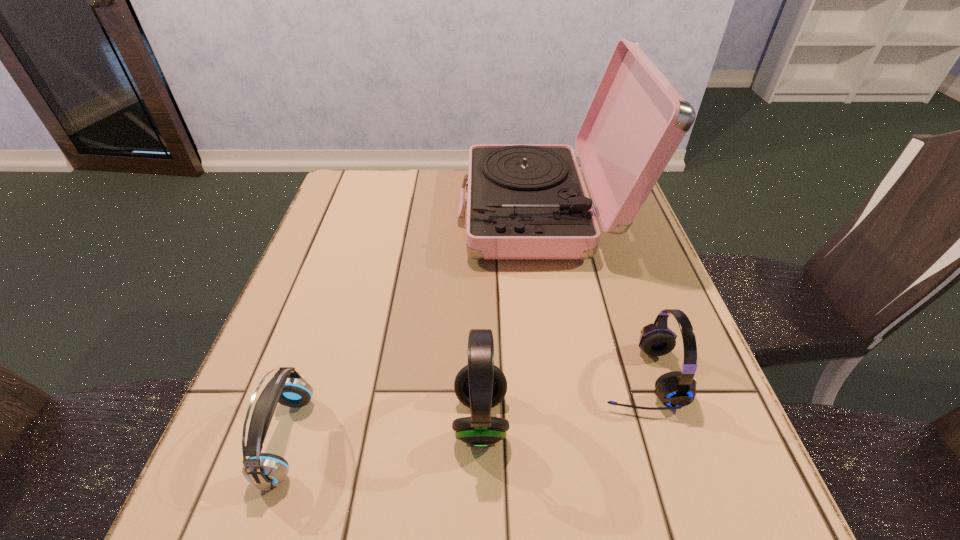
You are a GUI agent. You are given a task and a screenshot of the screen. Output one action in this format:
    pyautogui.click(x=<x>, y=<y>)
    Task: Click on the free space at the near right corner of the desktop
    
    Given the screenshot: What is the action you would take?
    pyautogui.click(x=738, y=536)

Locate an element on the screen. The height and width of the screenshot is (540, 960). vacant area between the third shortest object and the record player is located at coordinates (512, 315).

Image resolution: width=960 pixels, height=540 pixels. I want to click on empty location between the leftmost object and the second headset from left to right, so click(x=384, y=429).

You are a GUI agent. You are given a task and a screenshot of the screen. Output one action in this format:
    pyautogui.click(x=<x>, y=<y>)
    Task: Click on the blank region between the third tallest object and the record player
    The image size is (960, 540).
    Given the screenshot: What is the action you would take?
    pyautogui.click(x=590, y=294)

This screenshot has height=540, width=960. I want to click on empty space between the leftmost headset and the second headset from right to left, so click(384, 429).

Identify the location of free space between the second shortest object and the shortest object. (463, 408).

This screenshot has width=960, height=540. What are the coordinates of `empty space between the third tallest object and the leftmost headset` in the screenshot? It's located at (463, 408).

Identify the location of vacant area that lies between the tallest headset and the leftmost headset. (384, 429).

Identify the location of vacant space that is in between the tallest headset and the record player. The image size is (960, 540). (512, 315).

This screenshot has width=960, height=540. I want to click on empty location between the second shortest headset and the leftmost headset, so click(463, 408).